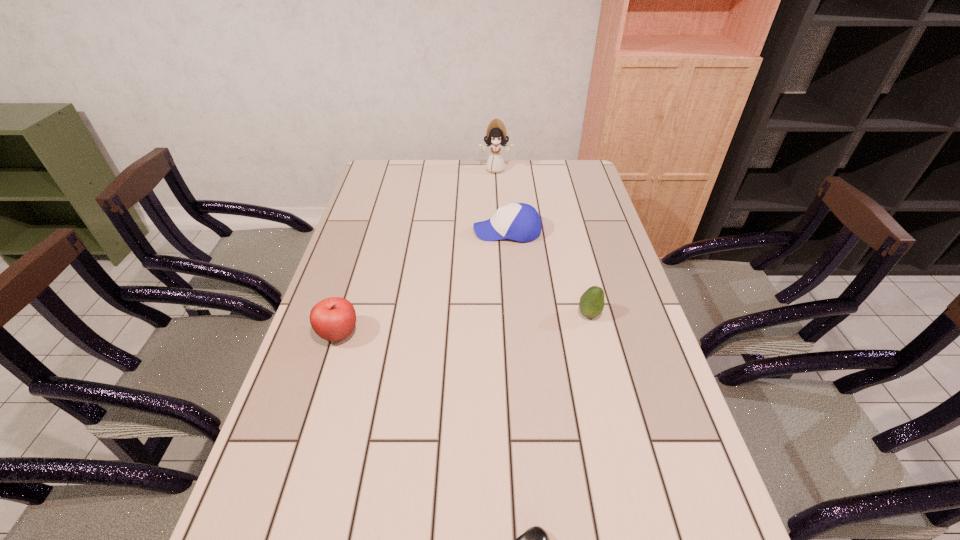
What are the coordinates of `vacant space in between the fourth nearest object and the doll` in the screenshot? It's located at (501, 200).

At what (x,y) coordinates should I click in order to perform the action: click on vacant space in between the tallest object and the baseball cap. Please return your answer as a coordinate pair (x, y). Looking at the image, I should click on (501, 200).

The height and width of the screenshot is (540, 960). In order to click on vacant space that's between the tallest object and the baseball cap in this screenshot , I will do `click(501, 200)`.

The height and width of the screenshot is (540, 960). I want to click on object that is the fourth closest to the mouse, so click(496, 136).

Locate an element on the screen. This screenshot has width=960, height=540. object that stands as the second closest to the avocado is located at coordinates (535, 539).

Where is `free spot that satisfies the following two spatial constraints: 1. on the front-facing side of the fourth nearest object; 2. on the back side of the avocado`? free spot that satisfies the following two spatial constraints: 1. on the front-facing side of the fourth nearest object; 2. on the back side of the avocado is located at coordinates (514, 314).